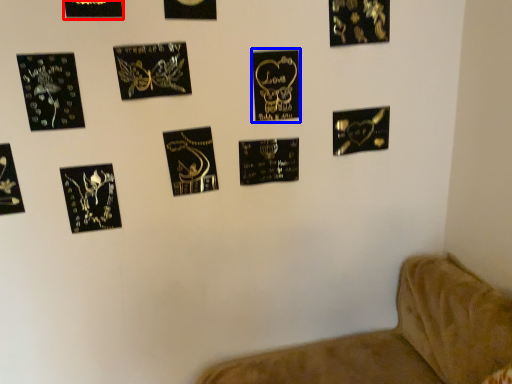
Question: Which object appears closest to the camera in this image, picture frame (highlighted by a red box) or picture frame (highlighted by a blue box)?

Choices:
 (A) picture frame
 (B) picture frame

Answer: (A)